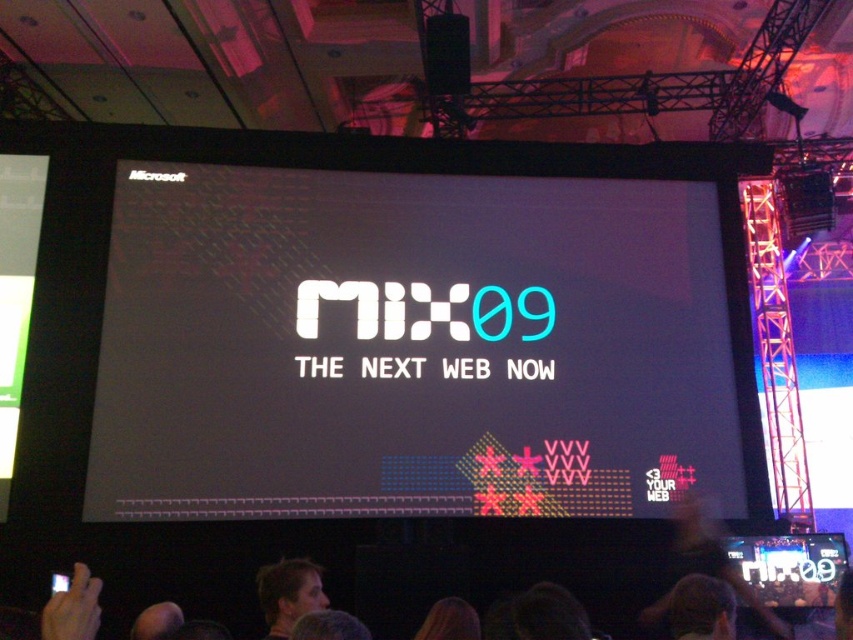
Who is positioned more to the left, light brown hair at lower center or brown hair at lower center?

light brown hair at lower center

Can you confirm if light brown hair at lower center is taller than brown hair at lower center?

Correct, light brown hair at lower center is much taller as brown hair at lower center.

Image resolution: width=853 pixels, height=640 pixels. Identify the location of light brown hair at lower center. (288, 593).

Who is positioned more to the left, dark hair at lower center or brown hair at lower center?

Positioned to the left is brown hair at lower center.

Which is in front, point (675, 602) or point (450, 605)?

Point (450, 605) is in front.

The height and width of the screenshot is (640, 853). Find the location of `dark hair at lower center`. dark hair at lower center is located at coordinates (701, 609).

You are a GUI agent. You are given a task and a screenshot of the screen. Output one action in this format:
    pyautogui.click(x=<x>, y=<y>)
    Task: Click on the dark hair at lower center
    The image size is (853, 640).
    Given the screenshot: What is the action you would take?
    pyautogui.click(x=701, y=609)

Between light brown hair at lower center and dark hair at lower center, which one is positioned higher?

Positioned higher is light brown hair at lower center.

Who is shorter, light brown hair at lower center or dark hair at lower center?

Standing shorter between the two is light brown hair at lower center.

Is point (314, 577) farther from camera compared to point (671, 627)?

No, (314, 577) is closer to viewer.

Where is `light brown hair at lower center`? light brown hair at lower center is located at coordinates (288, 593).